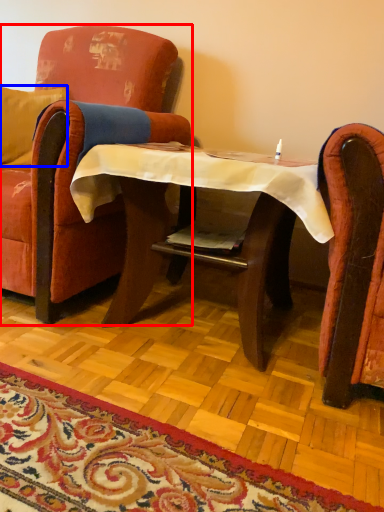
Question: Which point is further to the camera, chair (highlighted by a red box) or pillow (highlighted by a blue box)?

Choices:
 (A) chair
 (B) pillow

Answer: (B)